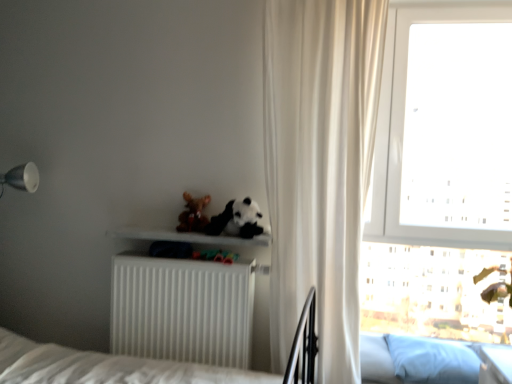
Describe the element at coordinates (442, 171) in the screenshot. The width and height of the screenshot is (512, 384). I see `transparent glass window at upper right` at that location.

The image size is (512, 384). What do you see at coordinates (432, 360) in the screenshot?
I see `blue fabric pillow at lower right` at bounding box center [432, 360].

What do you see at coordinates (186, 237) in the screenshot? I see `white matte shelf at center` at bounding box center [186, 237].

This screenshot has height=384, width=512. Find the location of `white sheer curtain at right`. white sheer curtain at right is located at coordinates pos(319,167).

Between fuzzy brown teddy bear at center and white sheer curtain at right, which one appears on the left side from the viewer's perspective?

fuzzy brown teddy bear at center is more to the left.

Does fuzzy brown teddy bear at center lie in front of white sheer curtain at right?

No, it is not.

Is fuzzy brown teddy bear at center next to white sheer curtain at right?

No, fuzzy brown teddy bear at center is not with white sheer curtain at right.

From the image's perspective, between white matte radiator at lower center and white matte shelf at center, who is located below?

From the image's view, white matte radiator at lower center is below.

Which is farther from the camera, (169,259) or (124,237)?

Point (124,237)

What are the coordinates of `shelf in front of the white matte radiator at lower center` in the screenshot? It's located at (186, 237).

Is white matte radiator at lower center bigger or smaller than white sheer curtain at right?

Clearly, white matte radiator at lower center is smaller in size than white sheer curtain at right.

Is white matte radiator at lower center spatially inside white sheer curtain at right, or outside of it?

white matte radiator at lower center cannot be found inside white sheer curtain at right.

Image resolution: width=512 pixels, height=384 pixels. I want to click on radiator behind the white sheer curtain at right, so click(182, 309).

Is there a large distance between white matte radiator at lower center and white sheer curtain at right?

No, white matte radiator at lower center is not far away from white sheer curtain at right.

Is transparent glass window at upper right looking in the opposite direction of white matte shelf at center?

No.

Which object is positioned more to the right, transparent glass window at upper right or white matte shelf at center?

transparent glass window at upper right.

Where is `window that appears above the white matte shelf at center (from the image's perspective)`? The image size is (512, 384). window that appears above the white matte shelf at center (from the image's perspective) is located at coordinates (442, 171).

From a real-world perspective, between transparent glass window at upper right and white matte shelf at center, who is vertically lower?

In real-world perspective, white matte shelf at center is lower.

Can blue fabric pillow at lower right be found inside transparent glass window at upper right?

No, blue fabric pillow at lower right is not surrounded by transparent glass window at upper right.

Which object is closer to the camera, transparent glass window at upper right or blue fabric pillow at lower right?

Positioned in front is blue fabric pillow at lower right.

Who is shorter, blue fabric pillow at lower right or white sheer curtain at right?

With less height is blue fabric pillow at lower right.

From a real-world perspective, is blue fabric pillow at lower right located higher than white sheer curtain at right?

Actually, blue fabric pillow at lower right is physically below white sheer curtain at right in the real world.

Is blue fabric pillow at lower right outside of white sheer curtain at right?

Yes.

Does blue fabric pillow at lower right appear on the right side of white sheer curtain at right?

Yes, blue fabric pillow at lower right is to the right of white sheer curtain at right.

Could you tell me if blue fabric pillow at lower right is turned towards white matte shelf at center?

No, blue fabric pillow at lower right does not turn towards white matte shelf at center.

From the image's perspective, who appears lower, blue fabric pillow at lower right or white matte shelf at center?

blue fabric pillow at lower right is shown below in the image.

Is blue fabric pillow at lower right beside white matte shelf at center?

No, blue fabric pillow at lower right is not touching white matte shelf at center.

How distant is blue fabric pillow at lower right from white matte shelf at center?

blue fabric pillow at lower right is 3.37 feet away from white matte shelf at center.

Where is `curtain that is above the fuzzy brown teddy bear at center (from a real-world perspective)`? The width and height of the screenshot is (512, 384). curtain that is above the fuzzy brown teddy bear at center (from a real-world perspective) is located at coordinates (319, 167).

You are a GUI agent. You are given a task and a screenshot of the screen. Output one action in this format:
    pyautogui.click(x=<x>, y=<y>)
    Task: Click on the shelf lying on the right of white matte radiator at lower center
    The image size is (512, 384).
    Given the screenshot: What is the action you would take?
    pyautogui.click(x=186, y=237)

When comparing their distances from blue fabric pillow at lower right, does white matte radiator at lower center or white sheer curtain at right seem closer?

white sheer curtain at right.

From the picture: Looking at the image, which one is located further to fuzzy brown teddy bear at center, white sheer curtain at right or blue fabric pillow at lower right?

The object further to fuzzy brown teddy bear at center is blue fabric pillow at lower right.

Based on their spatial positions, is white matte shelf at center or transparent glass window at upper right further from blue fabric pillow at lower right?

white matte shelf at center is positioned further to the anchor blue fabric pillow at lower right.

When comparing their distances from transparent glass window at upper right, does blue fabric pillow at lower right or white matte radiator at lower center seem further?

white matte radiator at lower center lies further to transparent glass window at upper right than the other object.

When comparing their distances from white matte radiator at lower center, does white matte shelf at center or white sheer curtain at right seem further?

Based on the image, white sheer curtain at right appears to be further to white matte radiator at lower center.

From the image, which object appears to be nearer to transparent glass window at upper right, fuzzy brown teddy bear at center or blue fabric pillow at lower right?

blue fabric pillow at lower right is closer to transparent glass window at upper right.

When comparing their distances from white sheer curtain at right, does white matte radiator at lower center or white matte shelf at center seem further?

white matte shelf at center is positioned further to the anchor white sheer curtain at right.

Based on their spatial positions, is white matte shelf at center or blue fabric pillow at lower right closer to fuzzy brown teddy bear at center?

white matte shelf at center is closer to fuzzy brown teddy bear at center.

This screenshot has width=512, height=384. What are the coordinates of `shelf between fuzzy brown teddy bear at center and white matte radiator at lower center from top to bottom` in the screenshot? It's located at (186, 237).

Where is `shelf between white matte radiator at lower center and blue fabric pillow at lower right in the horizontal direction`? The width and height of the screenshot is (512, 384). shelf between white matte radiator at lower center and blue fabric pillow at lower right in the horizontal direction is located at coordinates (186, 237).

In order to click on shelf situated between white matte radiator at lower center and white sheer curtain at right from left to right in this screenshot , I will do `click(186, 237)`.

Where is `curtain between white matte radiator at lower center and transparent glass window at upper right in the horizontal direction`? curtain between white matte radiator at lower center and transparent glass window at upper right in the horizontal direction is located at coordinates (319, 167).